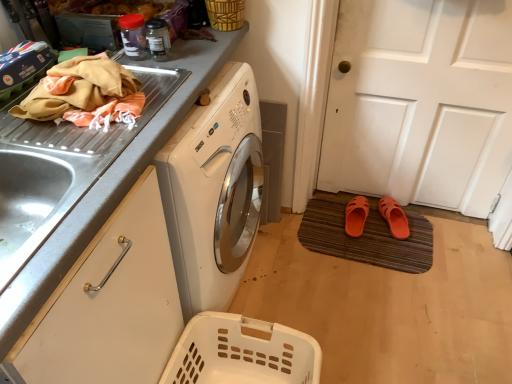
Where is `free space in front of orange rubber slipper at lower center, arranged as the first footwear when viewed from the left`? free space in front of orange rubber slipper at lower center, arranged as the first footwear when viewed from the left is located at coordinates (365, 251).